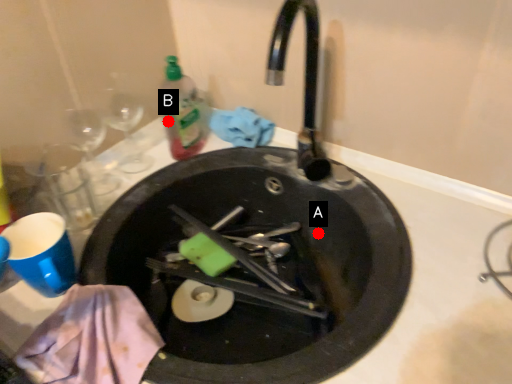
Question: Two points are circled on the image, labeled by A and B beside each circle. Which point is closer to the camera?

Choices:
 (A) A is closer
 (B) B is closer

Answer: (A)